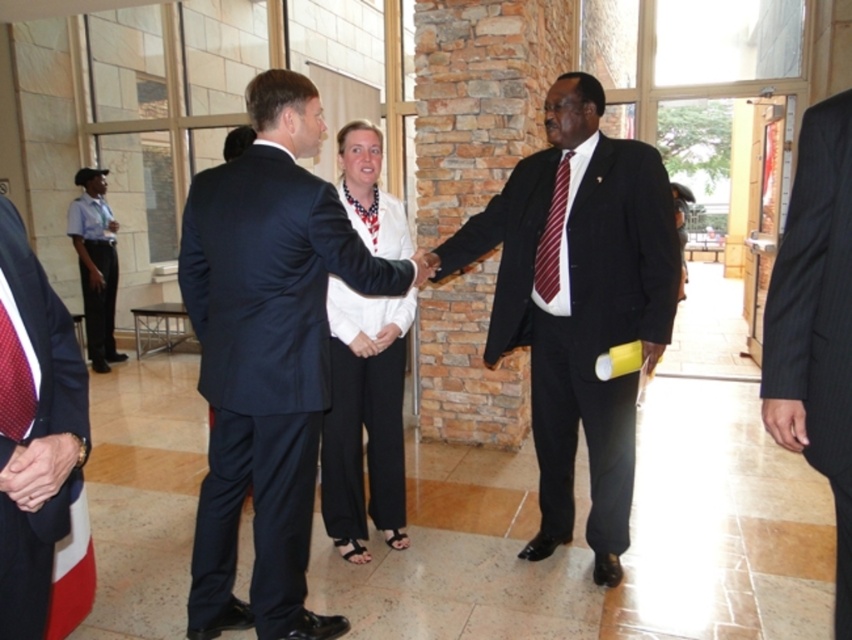
Between black pinstripe suit at center and maroon striped tie at center, which one appears on the right side from the viewer's perspective?

black pinstripe suit at center is more to the right.

Does point (845, 380) lie behind point (563, 184)?

No, (845, 380) is in front of (563, 184).

Between point (804, 188) and point (545, 268), which one is positioned in front?

Point (804, 188) is more forward.

What are the coordinates of `black pinstripe suit at center` in the screenshot? It's located at (816, 323).

Does dark blue wool suit at center appear on the left side of black pinstripe suit at center?

Correct, you'll find dark blue wool suit at center to the left of black pinstripe suit at center.

Between dark blue wool suit at center and black pinstripe suit at center, which one appears on the right side from the viewer's perspective?

Positioned to the right is black pinstripe suit at center.

Image resolution: width=852 pixels, height=640 pixels. Find the location of `dark blue wool suit at center`. dark blue wool suit at center is located at coordinates (266, 282).

Which of these two, red dotted tie at left or maroon striped tie at center, stands shorter?

Standing shorter between the two is maroon striped tie at center.

Does red dotted tie at left appear under maroon striped tie at center?

Indeed, red dotted tie at left is positioned under maroon striped tie at center.

The image size is (852, 640). Identify the location of red dotted tie at left. (39, 449).

Find the location of `red dotted tie at left`. red dotted tie at left is located at coordinates (39, 449).